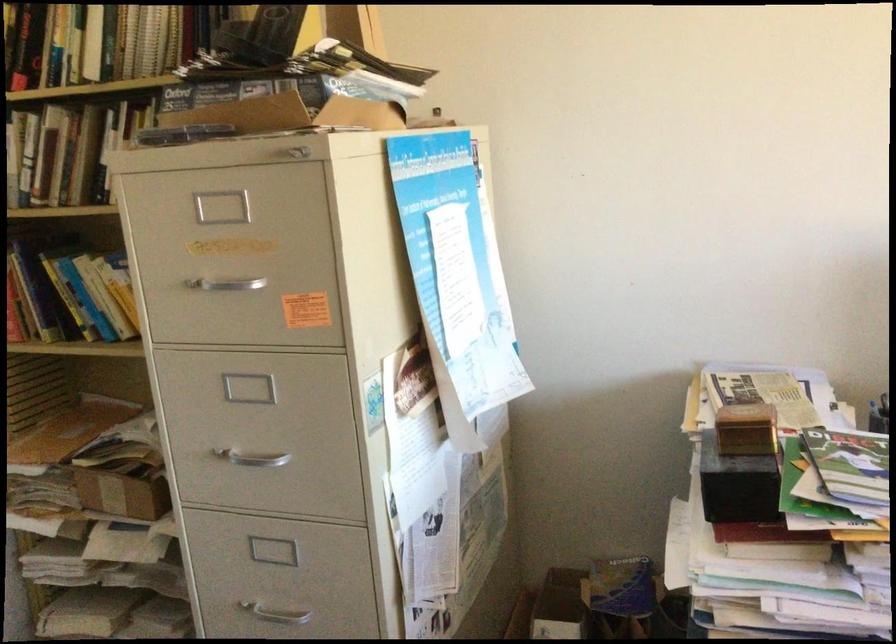
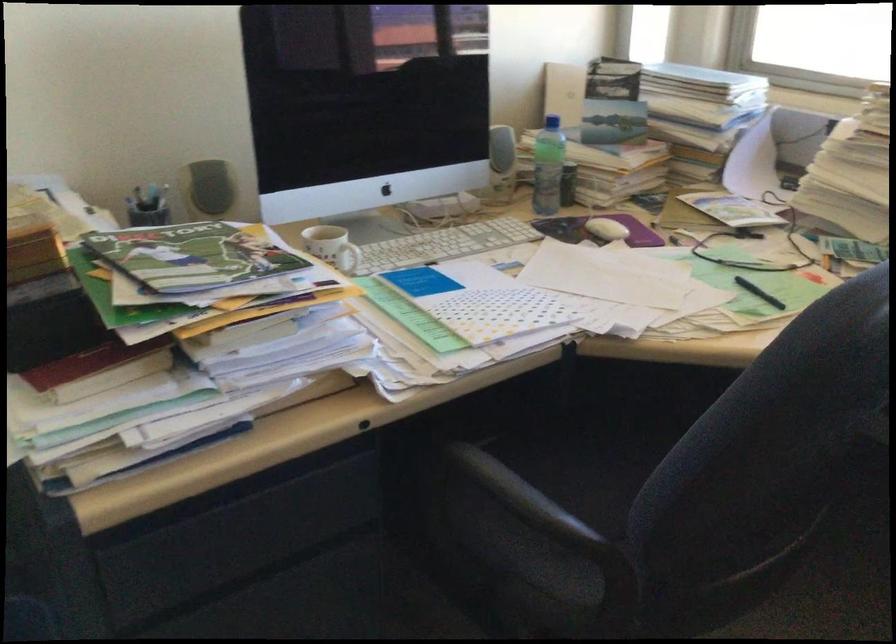
How did the camera likely rotate?

The camera rotated toward right-down.